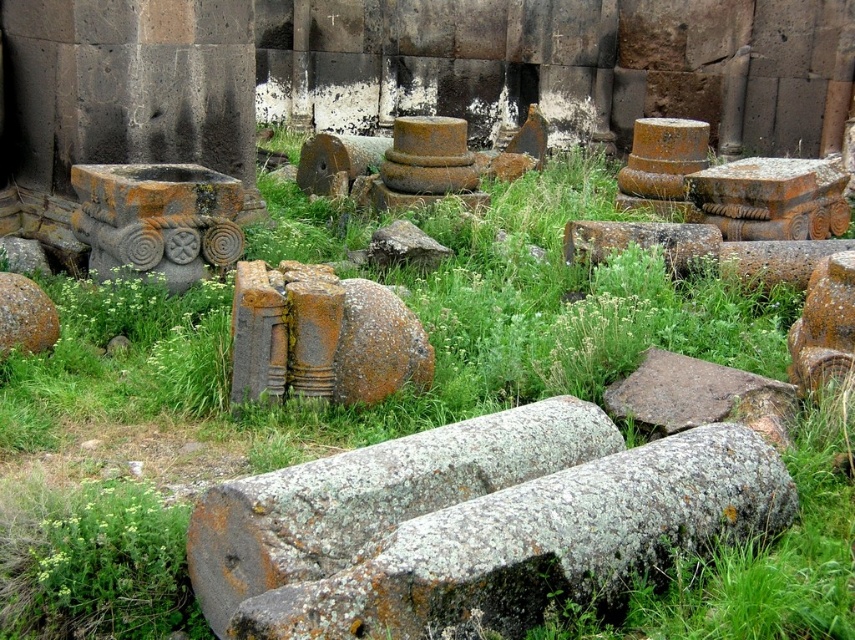
Between rusty metal column at center-right and rusty stone at lower left, which one appears on the right side from the viewer's perspective?

From the viewer's perspective, rusty metal column at center-right appears more on the right side.

Can you confirm if rusty metal column at center-right is shorter than rusty stone at lower left?

Yes.

Is point (767, 268) more distant than point (31, 292)?

Yes, it is.

This screenshot has width=855, height=640. I want to click on rusty metal column at center-right, so click(x=776, y=259).

Is point (93, 177) more distant than point (736, 244)?

That is False.

Is rusty stone carving at center-left wider than rusty metal column at center-right?

Indeed, rusty stone carving at center-left has a greater width compared to rusty metal column at center-right.

This screenshot has height=640, width=855. I want to click on rusty stone carving at center-left, so click(157, 218).

Between point (516, 444) and point (839, 372), which one is positioned in front?

Point (516, 444)

Between point (423, 492) and point (795, 365), which one is positioned behind?

Positioned behind is point (795, 365).

Is point (361, 536) positioned before point (821, 292)?

That is True.

This screenshot has width=855, height=640. Identify the location of lichen-covered stone at center. (372, 497).